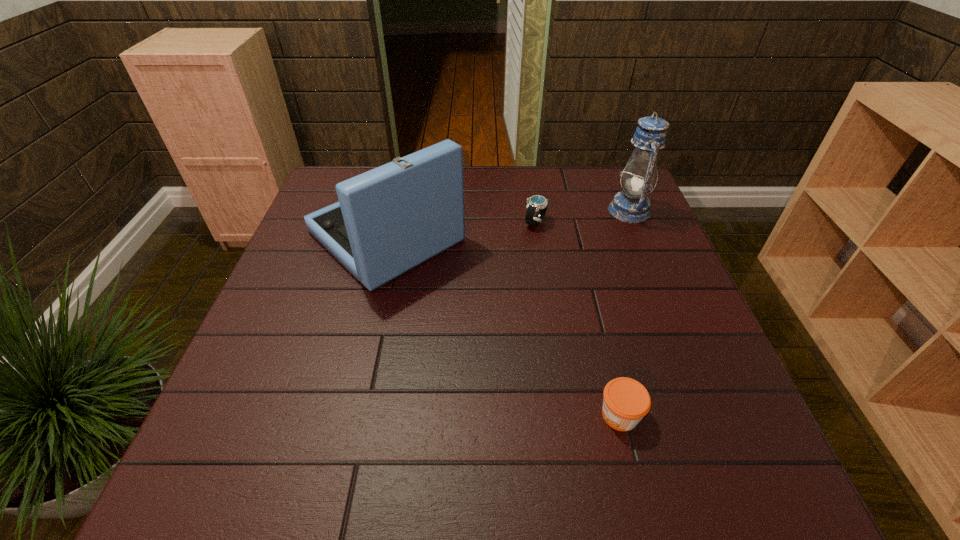
This screenshot has width=960, height=540. Identify the location of the rightmost object. (631, 205).

You are a GUI agent. You are given a task and a screenshot of the screen. Output one action in this format:
    pyautogui.click(x=<x>, y=<y>)
    Task: Click on the phonograph record
    
    Given the screenshot: What is the action you would take?
    pyautogui.click(x=388, y=220)

The height and width of the screenshot is (540, 960). I want to click on the second object from left to right, so click(538, 204).

Identify the location of the nearest object. This screenshot has height=540, width=960. 626,401.

The width and height of the screenshot is (960, 540). What are the coordinates of `jam` in the screenshot? It's located at pos(626,401).

The image size is (960, 540). I want to click on blank space located on the front-facing side of the lantern, so click(x=581, y=211).

Locate an element on the screen. The width and height of the screenshot is (960, 540). free space located on the front-facing side of the lantern is located at coordinates (546, 211).

I want to click on free point located on the front-facing side of the lantern, so click(585, 211).

Find the location of a particular element. This screenshot has width=960, height=540. vacant space positioned 0.090m on the right of the leftmost object is located at coordinates (498, 236).

Find the location of a particular element. vacant space located 0.110m on the back of the third object from right to left is located at coordinates (531, 192).